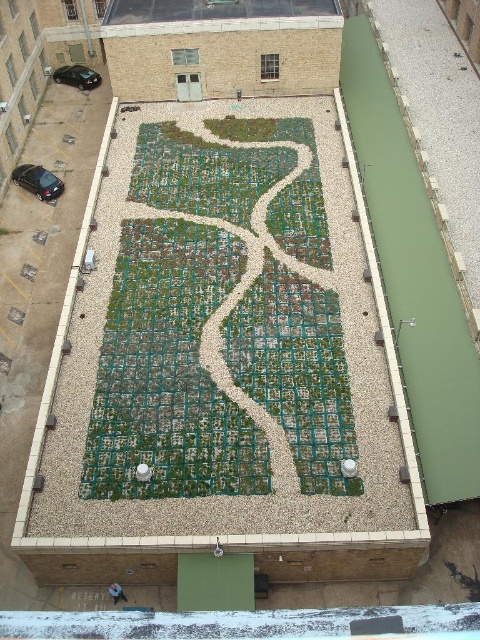
You are standing at the entrance of the rooftop garden and want to reach the green textured maze at center. According to the coordinates provided, in which direction should you move from your current position to reach it?

The green textured maze at center is located at coordinates point (220,323), so you should move towards the center of the rooftop garden to reach it.

You are a drone operator trying to capture a photo of the rooftop garden. You need to ensure both the point at (107, 362) and the point at (60, 189) are in focus. Which point should you focus on to ensure both are sharp?

You should focus on the point that is farther away from the camera, which is point (60, 189). By focusing on the farther point, the depth of field will include the closer point as well, ensuring both are in focus.

You are a delivery person trying to park your car in this rooftop garden. You see two cars already parked here, the glossy black car at lower left and the shiny black car at upper left. Which car takes up more space in the parking area?

The glossy black car at lower left takes up more space in the parking area because it is larger in size than the shiny black car at upper left.